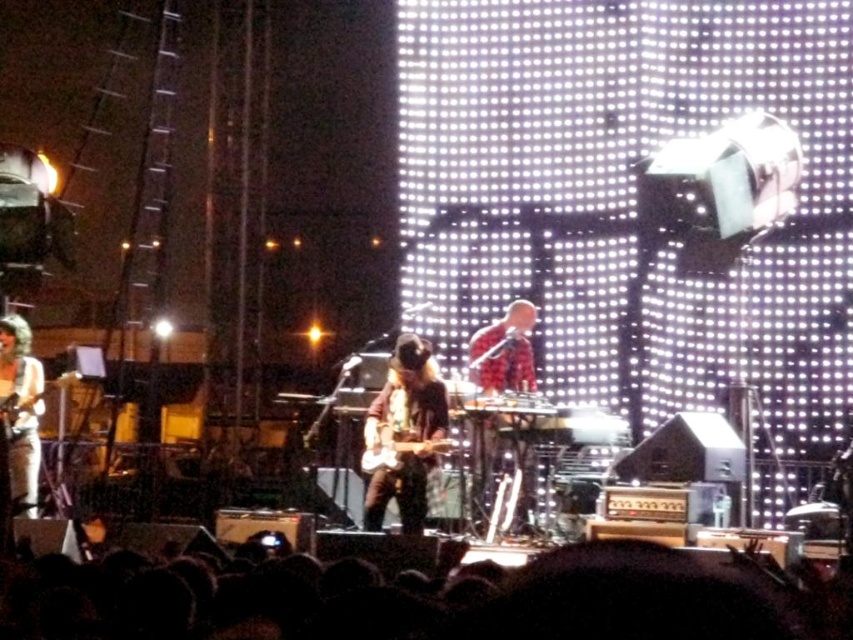
Does shiny black guitar at center have a smaller size compared to glossy wood electric guitar at lower left?

No.

Identify the location of shiny black guitar at center. Image resolution: width=853 pixels, height=640 pixels. 403,435.

Between shiny black guitar at left and glossy electric guitar at center, which one appears on the left side from the viewer's perspective?

shiny black guitar at left

Is point (0, 340) farther from camera compared to point (448, 442)?

That is True.

Image resolution: width=853 pixels, height=640 pixels. Describe the element at coordinates (20, 410) in the screenshot. I see `shiny black guitar at left` at that location.

Where is `shiny black guitar at left`? shiny black guitar at left is located at coordinates (20, 410).

Is point (399, 464) behind point (44, 410)?

That is False.

Between glossy electric guitar at center and glossy wood electric guitar at lower left, which one has less height?

glossy wood electric guitar at lower left

Locate an element on the screen. This screenshot has height=640, width=853. glossy electric guitar at center is located at coordinates point(399,451).